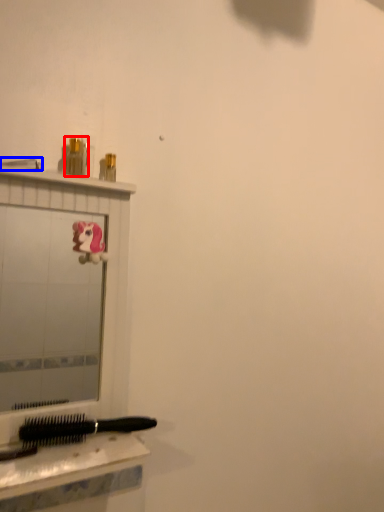
Question: Which object is further to the camera taking this photo, toiletry (highlighted by a red box) or shower (highlighted by a blue box)?

Choices:
 (A) toiletry
 (B) shower

Answer: (A)